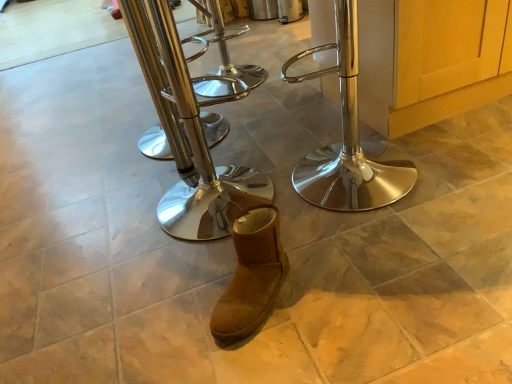
I want to click on free space to the left of brown suede boot at center, so click(x=177, y=311).